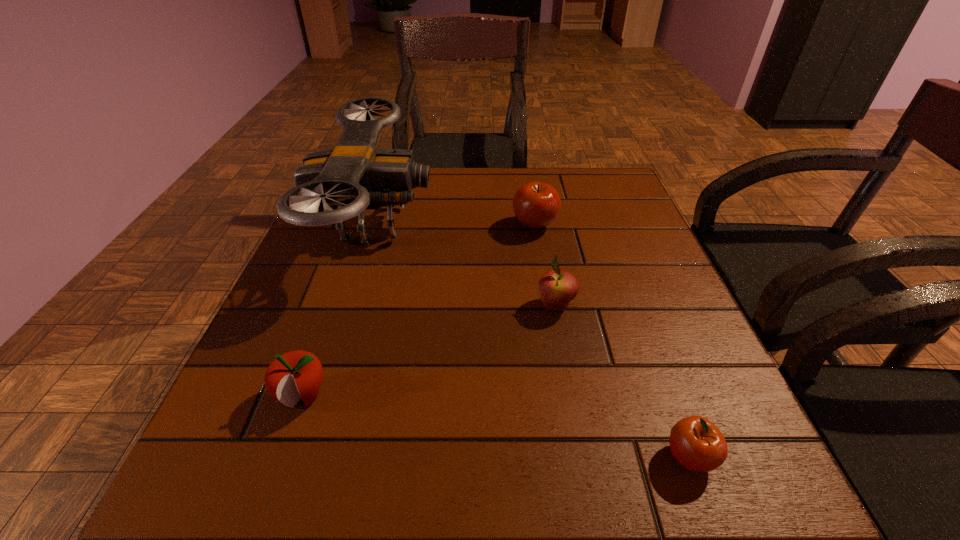
The height and width of the screenshot is (540, 960). What are the coordinates of `free region located 0.400m on the right of the third farthest apple` in the screenshot? It's located at (578, 396).

Locate an element on the screen. Image resolution: width=960 pixels, height=540 pixels. vacant area situated on the left of the nearest apple is located at coordinates (442, 457).

The width and height of the screenshot is (960, 540). In order to click on drone located in the far edge section of the desktop in this screenshot , I will do `click(353, 177)`.

Where is `apple located at the far edge`? This screenshot has width=960, height=540. apple located at the far edge is located at coordinates (536, 205).

Identify the location of object that is positioned at the near edge. (696, 443).

Image resolution: width=960 pixels, height=540 pixels. Find the location of `drone that is at the left edge`. drone that is at the left edge is located at coordinates (353, 177).

You are a GUI agent. You are given a task and a screenshot of the screen. Output one action in this format:
    pyautogui.click(x=<x>, y=<y>)
    Task: Click on the apple that is positioned at the left edge
    
    Given the screenshot: What is the action you would take?
    pyautogui.click(x=295, y=375)

This screenshot has height=540, width=960. Identify the location of object positioned at the right edge. (696, 443).

At what (x,y) coordinates should I click in order to perform the action: click on object that is at the far left corner. Please return your answer as a coordinate pair (x, y). Looking at the image, I should click on (353, 177).

Where is `object located in the near right corner section of the desktop`? The height and width of the screenshot is (540, 960). object located in the near right corner section of the desktop is located at coordinates (696, 443).